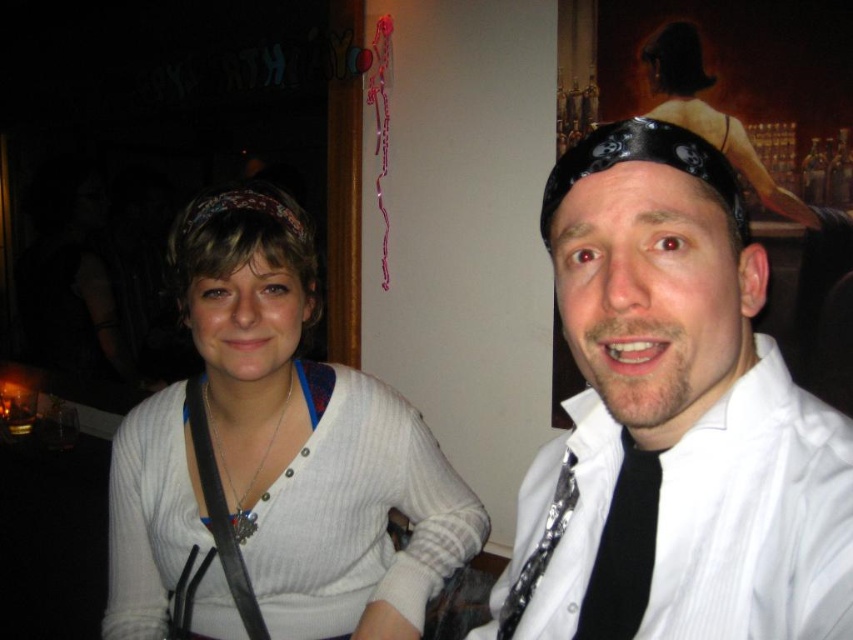
Question: Among these objects, which one is farthest from the camera?

Choices:
 (A) black satin tie at center
 (B) white ribbed sweater at center
 (C) shiny silver tie at right

Answer: (B)

Question: Is white glossy shirt at upper right bigger than shiny silver tie at right?

Choices:
 (A) no
 (B) yes

Answer: (B)

Question: Where is white glossy shirt at upper right located in relation to white ribbed sweater at center in the image?

Choices:
 (A) below
 (B) above

Answer: (B)

Question: Which point is farther from the camera taking this photo?

Choices:
 (A) (189, 536)
 (B) (605, 563)
 (C) (622, 584)

Answer: (A)

Question: Which of these objects is positioned closest to the white glossy shirt at upper right?

Choices:
 (A) white ribbed sweater at center
 (B) shiny silver tie at right
 (C) black satin tie at center

Answer: (C)

Question: In this image, where is white glossy shirt at upper right located relative to black satin tie at center?

Choices:
 (A) below
 (B) above

Answer: (B)